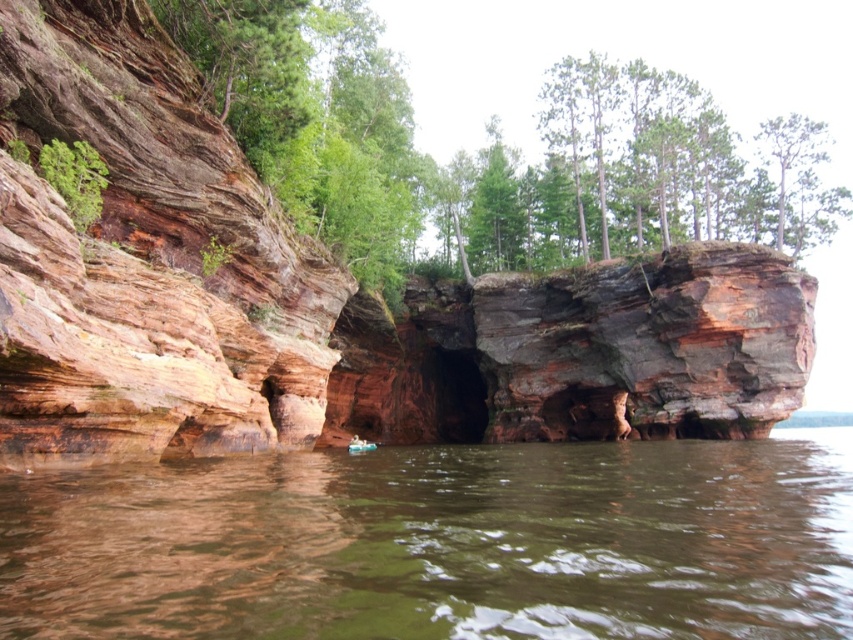
You are a geologist examining the image and need to determine the relative position of the brown sedimentary rock at center and the rustic stone cliff at center. Which object is positioned to the right of the other?

The brown sedimentary rock at center is positioned to the right of the rustic stone cliff at center.